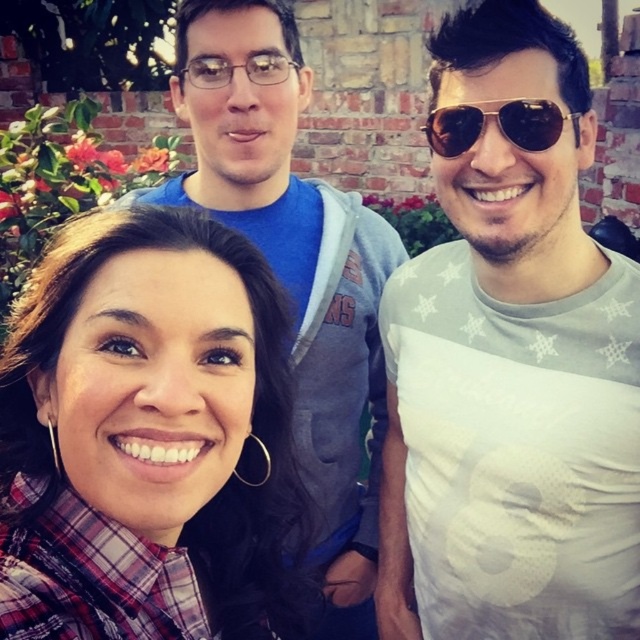
In the photo, there are three people. The woman on the left is wearing a plaid shirt. The man in the center has a blue tshirt under a gray hoodie. There is a point marked at coordinates (148, 438). Which person is this point indicating?

The point at (148, 438) marks the plaid fabric shirt at center, which belongs to the man in the center.

From the picture: You are standing in a garden with a brick wall in the background. There is a point at coordinates point (417, 621). If you want to place a 3 meter long pole horizontally from this point, will it fit within the garden without going beyond the brick wall?

The distance of point (417, 621) from viewer is 2.95 meters. Since the pole is 3 meters long, placing it horizontally from this point would extend beyond the 2.95 meters distance to the wall, so it might not fit within the garden without going beyond the brick wall.